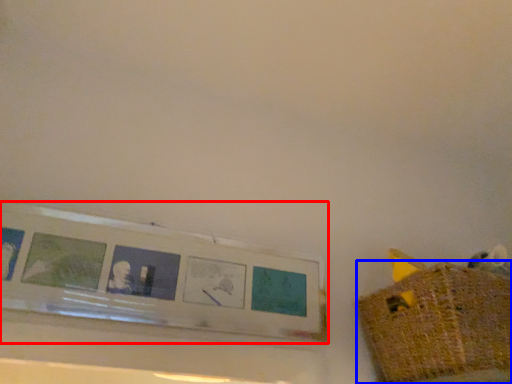
Question: Among these objects, which one is nearest to the camera, picture frame (highlighted by a red box) or basket (highlighted by a blue box)?

Choices:
 (A) picture frame
 (B) basket

Answer: (B)